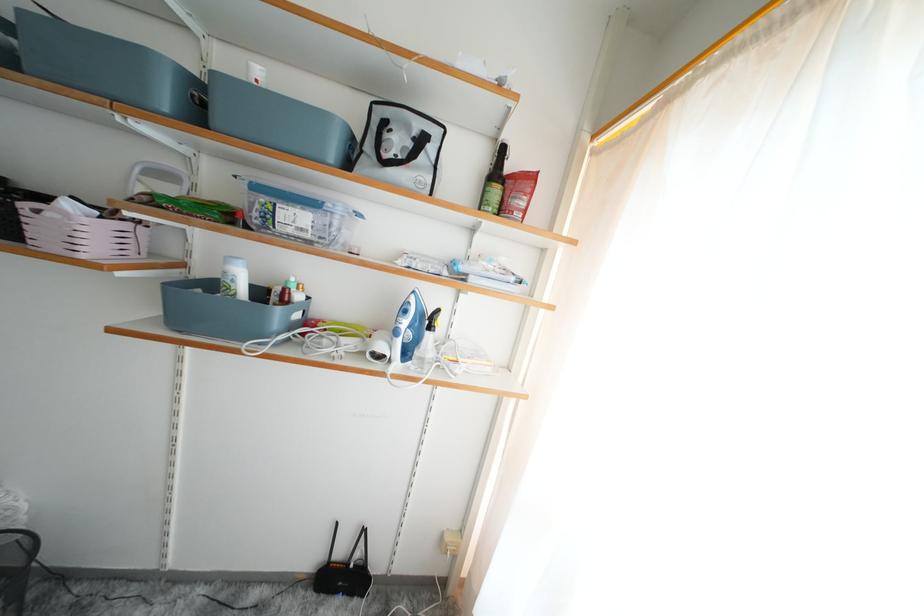
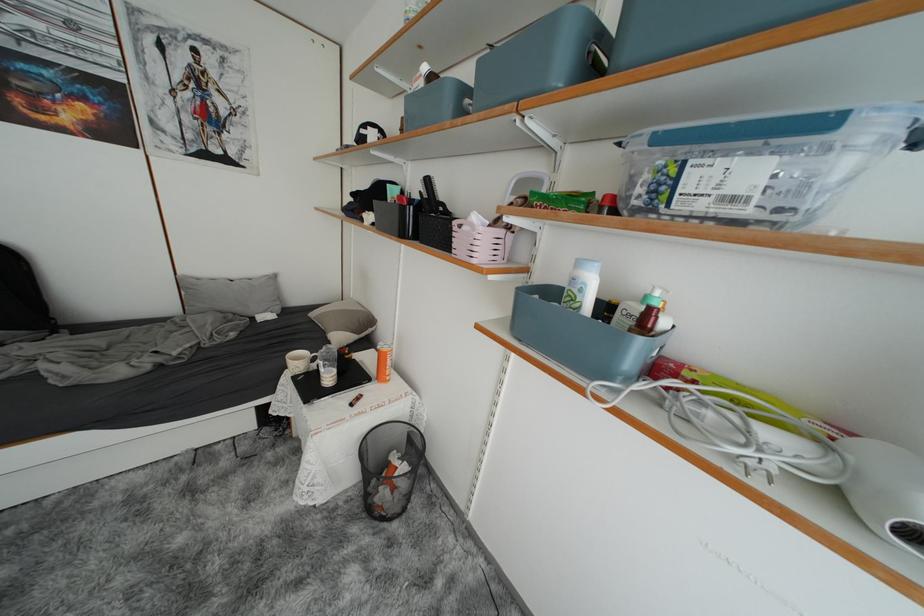
In the second image, find the point that corresponds to point 330,337 in the first image.

(713, 402)